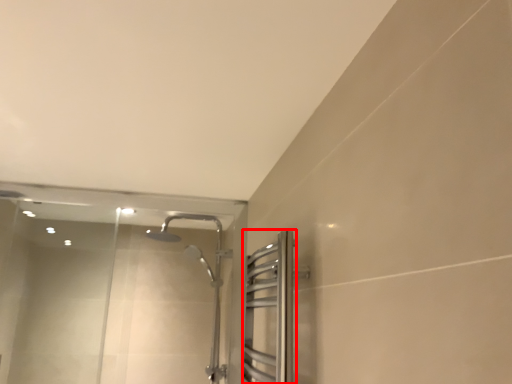
Question: From the image's perspective, considering the relative positions of screen door (annotated by the red box) and glass door in the image provided, where is screen door (annotated by the red box) located with respect to the staircase?

Choices:
 (A) above
 (B) below

Answer: (A)